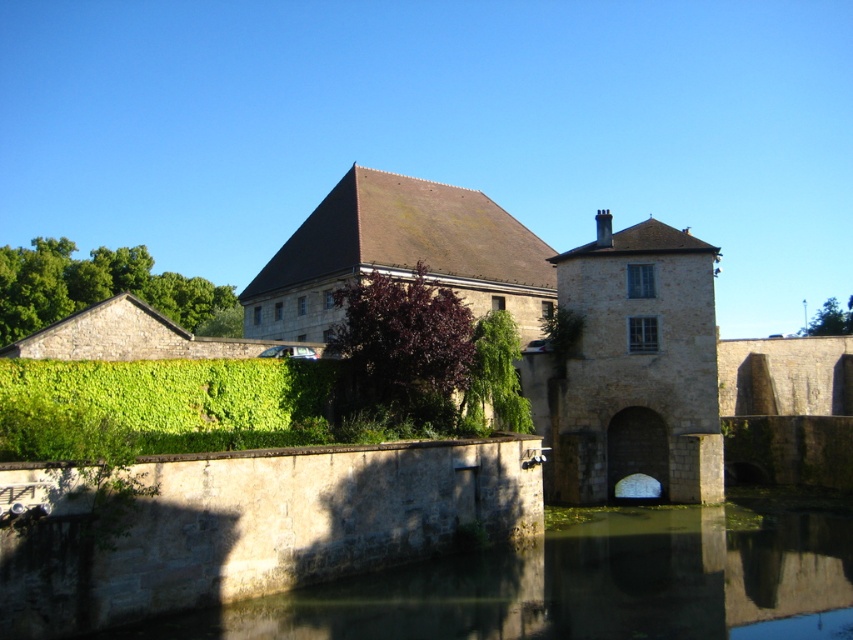
You are standing in front of the historic stone building and want to walk towards the green leafy hedge at center. Which direction should you move to avoid the green leafy hedge at upper left?

To avoid the green leafy hedge at upper left, you should move towards the green leafy hedge at center since it is closer to you and positioned in front of the upper left hedge.

You are standing at the point marked by the coordinates point (158, 406) in the image. Looking towards the historic stone building, which direction should you walk to reach the green leafy hedge at lower left?

The green leafy hedge at lower left is represented by point (158, 406), so you are already at the location of the green leafy hedge at lower left. Therefore, you don not need to walk anywhere else.

You are a gardener who needs to water the green leafy hedge at lower left and the green leafy hedge at center. If your watering can holds enough water for 5 meters of travel, can you water both hedges without needing to refill?

The green leafy hedge at lower left is 6.88 meters away from the green leafy hedge at center. Since the distance between them exceeds the 5 meters your watering can can cover, you will need to refill before moving between them.